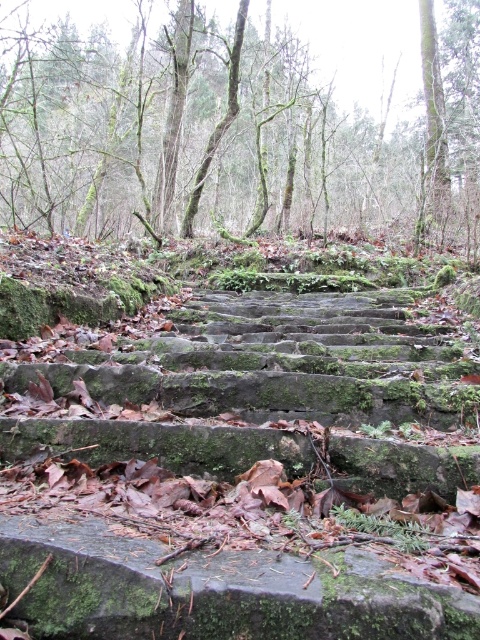
Question: Is mossy stone stairs at center further to the viewer compared to green mossy stone steps at center?

Choices:
 (A) no
 (B) yes

Answer: (A)

Question: Is mossy stone stairs at center behind green mossy stone steps at center?

Choices:
 (A) no
 (B) yes

Answer: (A)

Question: Does mossy stone stairs at center appear on the right side of green mossy stone steps at center?

Choices:
 (A) no
 (B) yes

Answer: (A)

Question: Which point appears closest to the camera in this image?

Choices:
 (A) (430, 138)
 (B) (51, 404)

Answer: (B)

Question: Which object appears farthest from the camera in this image?

Choices:
 (A) mossy stone stairs at center
 (B) green mossy stone steps at center

Answer: (B)